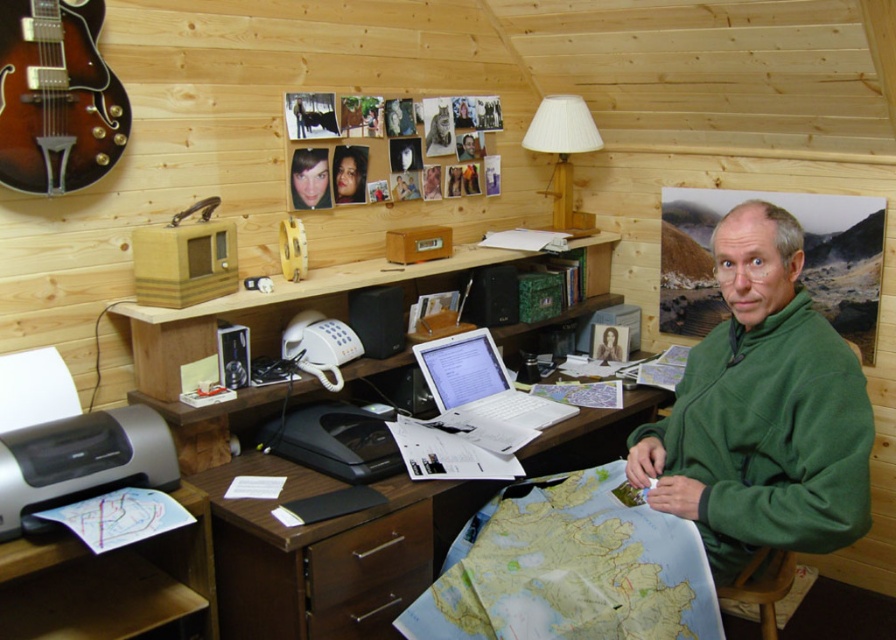
Question: Among these objects, which one is farthest from the camera?

Choices:
 (A) white fabric lampshade at upper center
 (B) wooden chair at lower right
 (C) gray matte printer at lower left

Answer: (A)

Question: Is gray matte printer at lower left below white glossy laptop at center?

Choices:
 (A) yes
 (B) no

Answer: (A)

Question: Observing the image, what is the correct spatial positioning of brown wood computer desk at center in reference to blue paper map at lower right?

Choices:
 (A) below
 (B) above

Answer: (B)

Question: Is the position of green fleece jacket at center less distant than that of wooden chair at lower right?

Choices:
 (A) yes
 (B) no

Answer: (A)

Question: Which point is closer to the camera?

Choices:
 (A) (321, 588)
 (B) (575, 99)

Answer: (A)

Question: Considering the real-world distances, which object is closest to the white fabric lampshade at upper center?

Choices:
 (A) gray matte printer at lower left
 (B) blue paper map at lower right
 (C) green fleece jacket at center

Answer: (C)